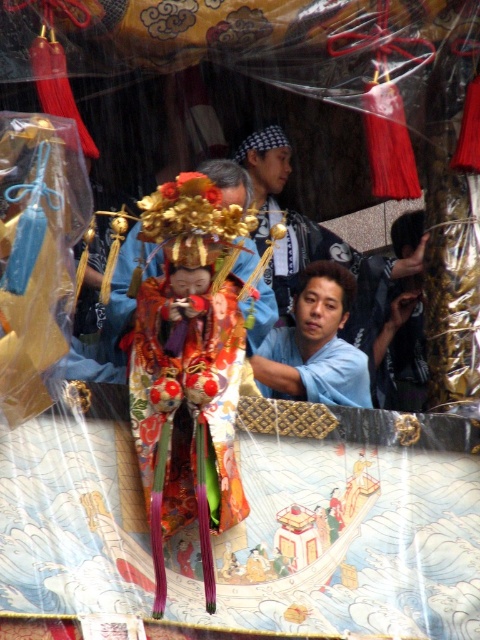
Is blue cotton shirt at center shorter than matte blue shirt at center?

No.

Is blue cotton shirt at center below matte blue shirt at center?

Incorrect, blue cotton shirt at center is not positioned below matte blue shirt at center.

Between point (345, 259) and point (296, 317), which one is positioned behind?

Point (345, 259)

You are a GUI agent. You are given a task and a screenshot of the screen. Output one action in this format:
    pyautogui.click(x=<x>, y=<y>)
    Task: Click on the blue cotton shirt at center
    
    Given the screenshot: What is the action you would take?
    [356, 294]